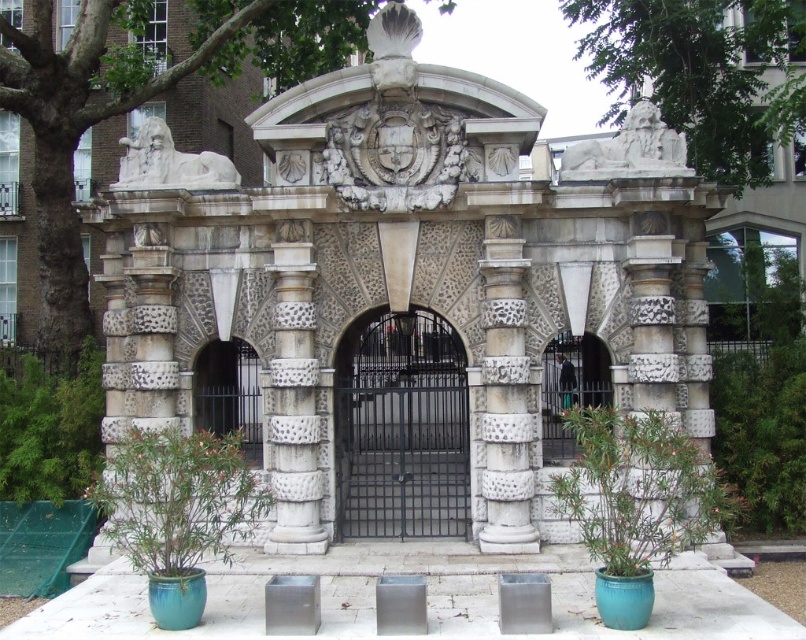
You are an architect designing a new gate. You need to know the relative thickness of the existing black metal gate at center and the white stone lion at upper left to ensure compatibility with your design. Which object is thinner?

The black metal gate at center is thinner than the white stone lion at upper left according to the description.

You are standing in front of the historical gate. There are two objects in front of you, the speckled stone column at center and the polished metal gate at center. Which object is closer to you?

The speckled stone column at center is closer to you since it is in front of the polished metal gate at center.

You are a tour guide leading a group through this historical site. You want to inform your visitors about the distance between the speckled stone column at center and the polished metal gate at center. How far apart are they?

The distance between the speckled stone column at center and the polished metal gate at center is 25.68 feet.